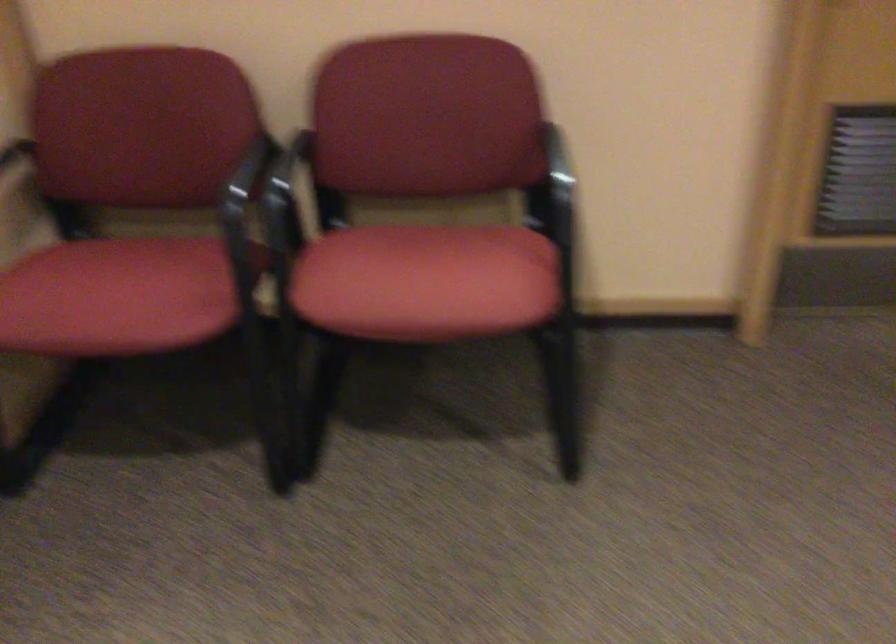
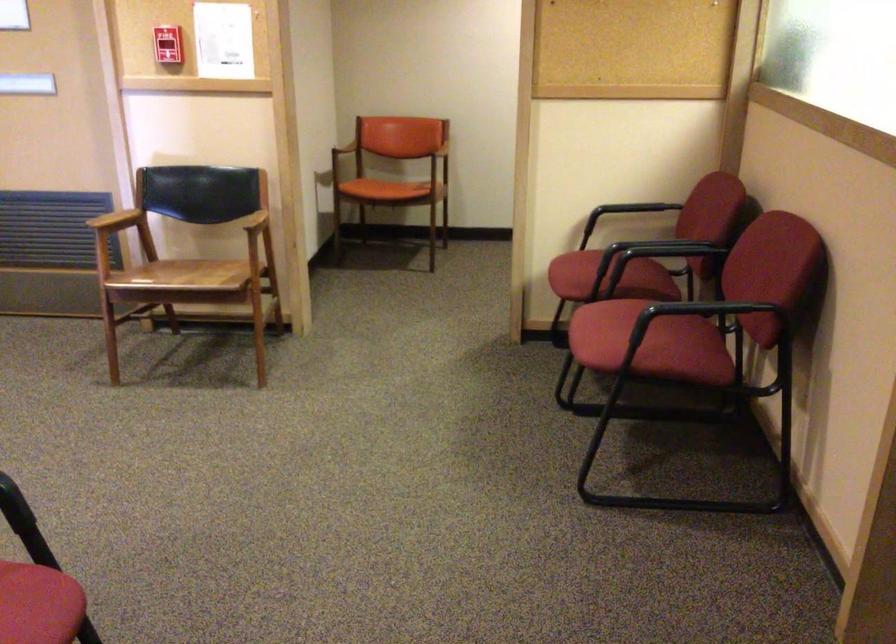
Where in the second image is the point corresponding to (488,248) from the first image?

(650, 343)